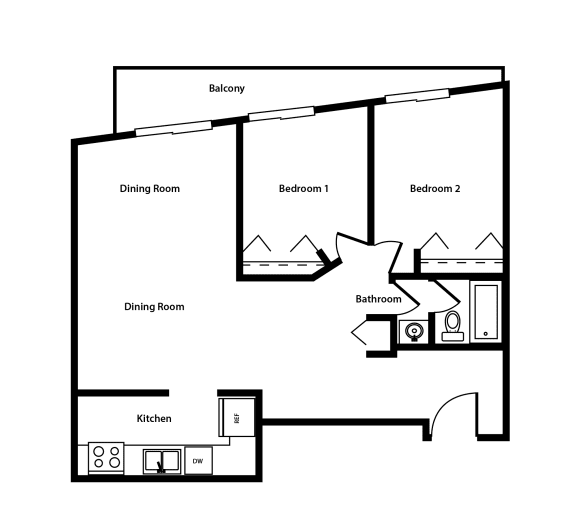
Locate an element on the screen. door is located at coordinates (452, 295).